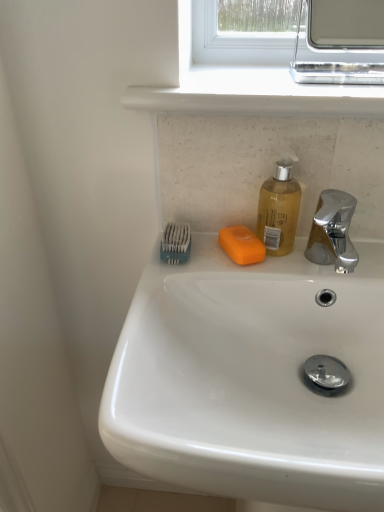
Question: From the image's perspective, is white smooth window sill at upper center located above white glossy sink at center?

Choices:
 (A) yes
 (B) no

Answer: (A)

Question: Can we say white smooth window sill at upper center lies outside white glossy sink at center?

Choices:
 (A) no
 (B) yes

Answer: (B)

Question: From the image's perspective, is white smooth window sill at upper center located beneath white glossy sink at center?

Choices:
 (A) yes
 (B) no

Answer: (B)

Question: Is white smooth window sill at upper center smaller than white glossy sink at center?

Choices:
 (A) no
 (B) yes

Answer: (B)

Question: Is white smooth window sill at upper center at the left side of white glossy sink at center?

Choices:
 (A) no
 (B) yes

Answer: (B)

Question: Can you confirm if white smooth window sill at upper center is positioned to the right of white glossy sink at center?

Choices:
 (A) no
 (B) yes

Answer: (A)

Question: Considering the relative sizes of blue plastic toothbrush at upper left and chrome metallic medicine cabinet at upper right in the image provided, is blue plastic toothbrush at upper left thinner than chrome metallic medicine cabinet at upper right?

Choices:
 (A) no
 (B) yes

Answer: (B)

Question: Is the depth of blue plastic toothbrush at upper left greater than that of chrome metallic medicine cabinet at upper right?

Choices:
 (A) yes
 (B) no

Answer: (A)

Question: Are blue plastic toothbrush at upper left and chrome metallic medicine cabinet at upper right making contact?

Choices:
 (A) yes
 (B) no

Answer: (B)

Question: Is blue plastic toothbrush at upper left to the right of chrome metallic medicine cabinet at upper right from the viewer's perspective?

Choices:
 (A) yes
 (B) no

Answer: (B)

Question: Does blue plastic toothbrush at upper left have a greater height compared to chrome metallic medicine cabinet at upper right?

Choices:
 (A) no
 (B) yes

Answer: (A)

Question: Is blue plastic toothbrush at upper left oriented away from chrome metallic medicine cabinet at upper right?

Choices:
 (A) yes
 (B) no

Answer: (B)

Question: Considering the relative sizes of orange matte soap at center and white glossy sink at center in the image provided, is orange matte soap at center taller than white glossy sink at center?

Choices:
 (A) yes
 (B) no

Answer: (B)